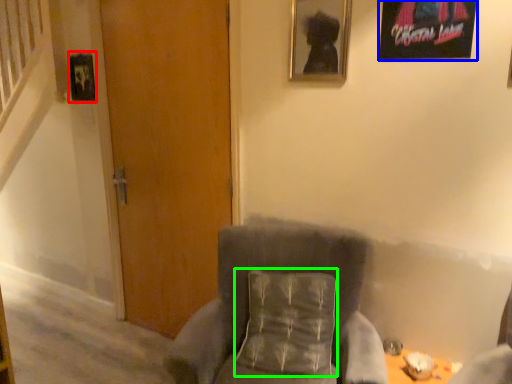
Question: Considering the real-world distances, which object is farthest from picture frame (highlighted by a red box)? picture frame (highlighted by a blue box) or pillow (highlighted by a green box)?

Choices:
 (A) picture frame
 (B) pillow

Answer: (A)